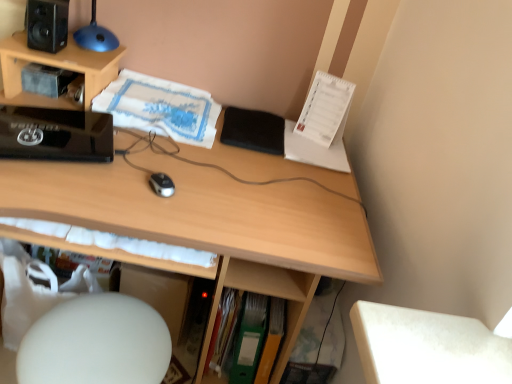
I want to click on blank space above white matte computer chair at lower left (from a real-world perspective), so click(99, 342).